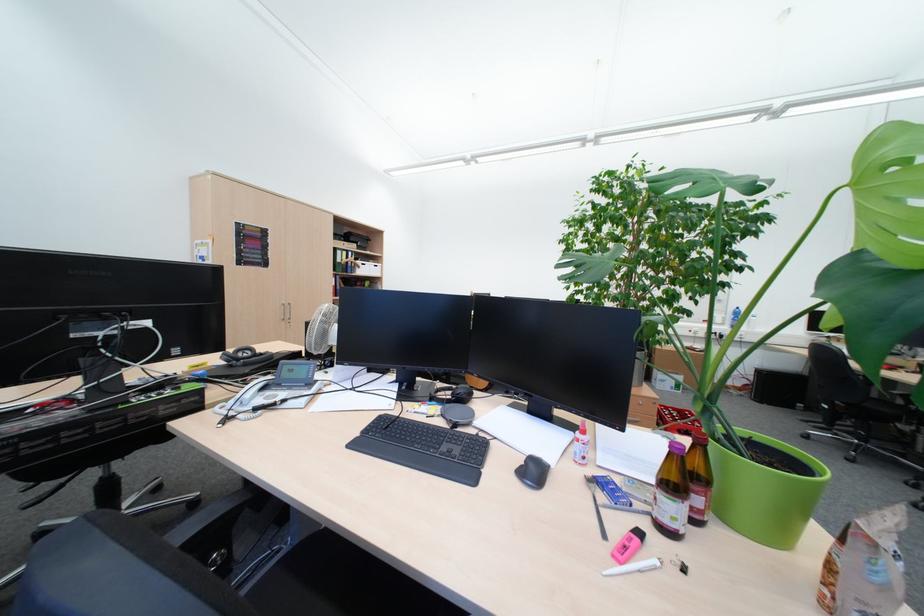
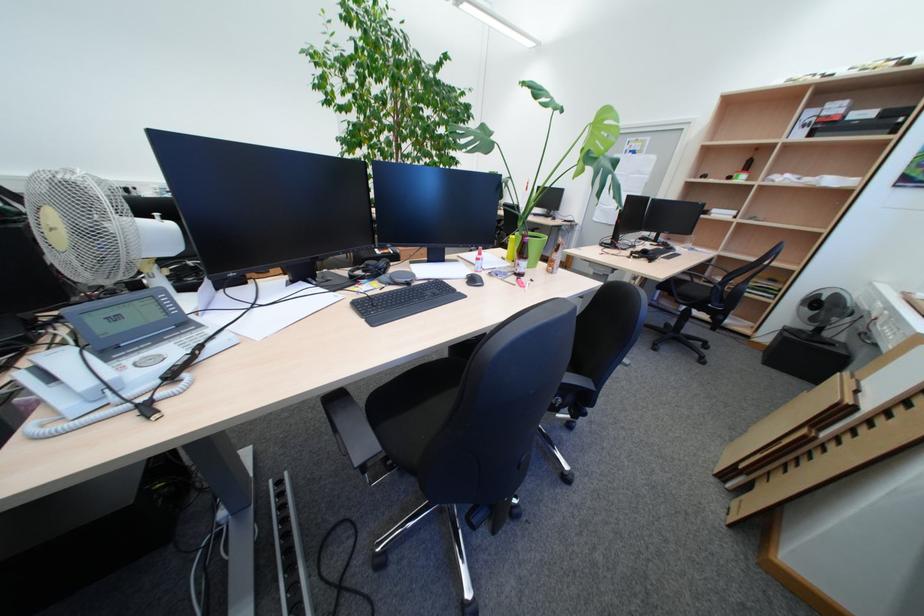
How did the camera likely rotate?

The camera rotated toward right-down.